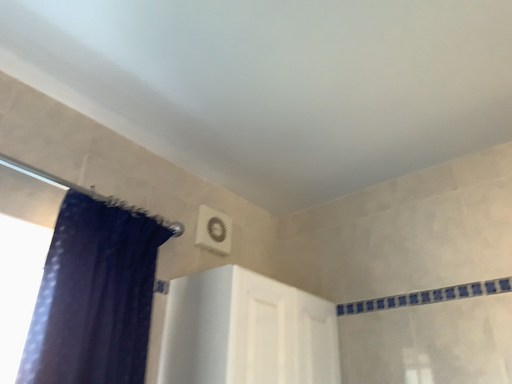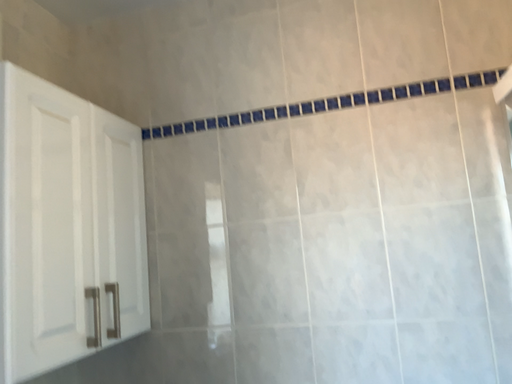
Question: Which way did the camera rotate in the video?

Choices:
 (A) rotated left
 (B) rotated right

Answer: (B)